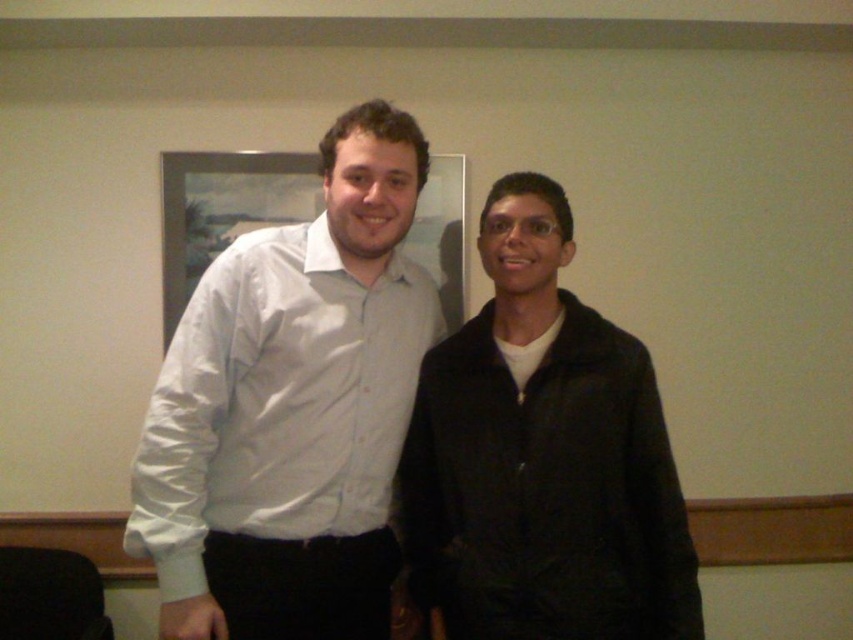
Question: Can you confirm if white glossy shirt at center is positioned to the left of black matte jacket at right?

Choices:
 (A) no
 (B) yes

Answer: (B)

Question: Which point is closer to the camera?

Choices:
 (A) (322, 582)
 (B) (460, 420)
 (C) (251, 193)

Answer: (B)

Question: Which of the following is the closest to the observer?

Choices:
 (A) white glossy shirt at center
 (B) black matte jacket at right

Answer: (B)

Question: Is black matte jacket at right positioned at the back of white glossy frame at upper center?

Choices:
 (A) no
 (B) yes

Answer: (A)

Question: In this image, where is white glossy shirt at center located relative to white glossy frame at upper center?

Choices:
 (A) below
 (B) above

Answer: (A)

Question: Based on their relative distances, which object is farther from the white glossy frame at upper center?

Choices:
 (A) white glossy shirt at center
 (B) black matte jacket at right

Answer: (B)